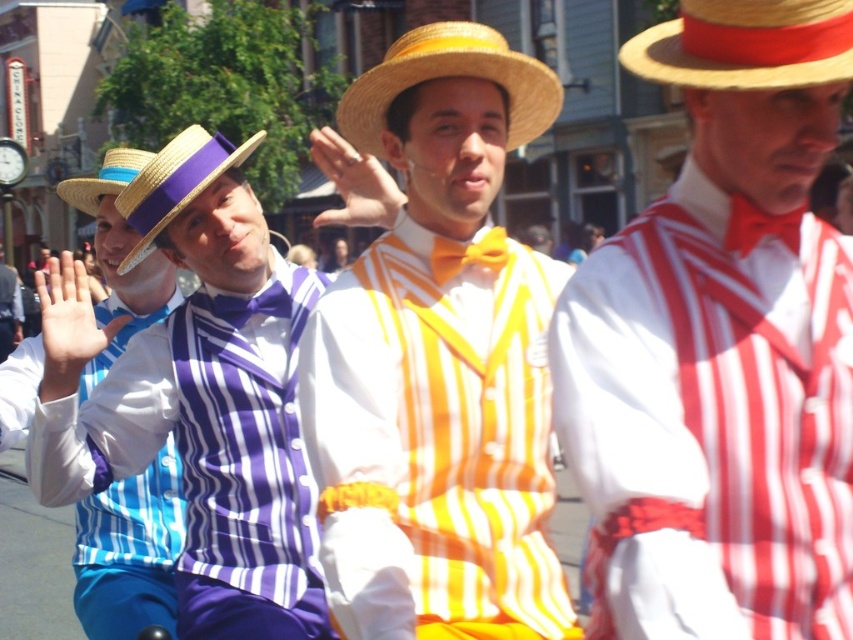
Is red and white striped shirt at center thinner than matte straw cowboy hat at upper right?

Correct, red and white striped shirt at center's width is less than matte straw cowboy hat at upper right's.

Does red and white striped shirt at center appear under matte straw cowboy hat at upper right?

Yes.

Find the location of `red and white striped shirt at center`. red and white striped shirt at center is located at coordinates (720, 348).

Image resolution: width=853 pixels, height=640 pixels. What are the coordinates of `red and white striped shirt at center` in the screenshot? It's located at (720, 348).

Consider the image. Is yellow striped vest at center smaller than matte purple vest at center?

Yes.

Where is `yellow striped vest at center`? The image size is (853, 640). yellow striped vest at center is located at coordinates (438, 364).

Who is more distant from viewer, (x=440, y=596) or (x=256, y=301)?

Point (x=256, y=301)

The width and height of the screenshot is (853, 640). What do you see at coordinates (438, 364) in the screenshot? I see `yellow striped vest at center` at bounding box center [438, 364].

Where is `yellow striped vest at center`? The width and height of the screenshot is (853, 640). yellow striped vest at center is located at coordinates (438, 364).